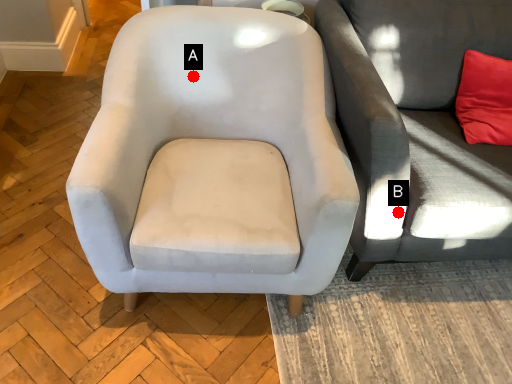
Question: Two points are circled on the image, labeled by A and B beside each circle. Which point is closer to the camera taking this photo?

Choices:
 (A) A is closer
 (B) B is closer

Answer: (B)